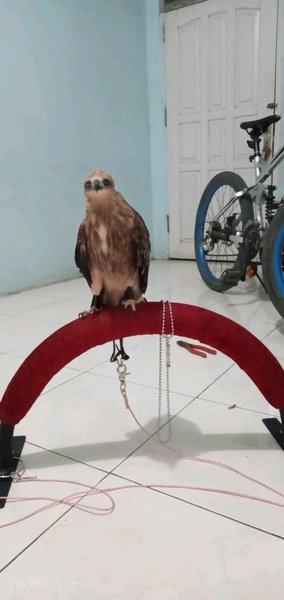
Locate an element on the screen. The width and height of the screenshot is (284, 600). cords is located at coordinates (56, 501), (68, 497), (68, 483), (139, 421).